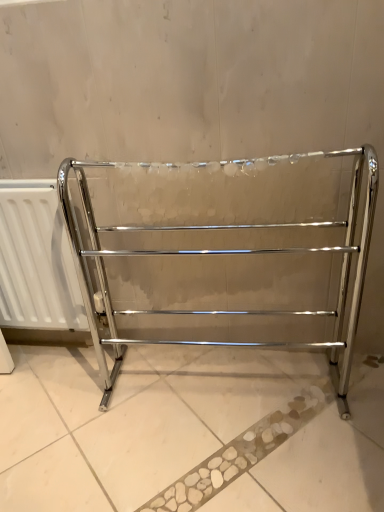
Question: Is white matte radiator at left to the right of polished chrome towel rack at center from the viewer's perspective?

Choices:
 (A) no
 (B) yes

Answer: (A)

Question: From the image's perspective, is white matte radiator at left located above polished chrome towel rack at center?

Choices:
 (A) yes
 (B) no

Answer: (A)

Question: From a real-world perspective, does white matte radiator at left sit lower than polished chrome towel rack at center?

Choices:
 (A) yes
 (B) no

Answer: (A)

Question: From a real-world perspective, is white matte radiator at left positioned over polished chrome towel rack at center based on gravity?

Choices:
 (A) yes
 (B) no

Answer: (B)

Question: From the image's perspective, is white matte radiator at left located beneath polished chrome towel rack at center?

Choices:
 (A) yes
 (B) no

Answer: (B)

Question: Considering the relative sizes of white matte radiator at left and polished chrome towel rack at center in the image provided, is white matte radiator at left shorter than polished chrome towel rack at center?

Choices:
 (A) yes
 (B) no

Answer: (A)

Question: Is polished chrome towel rack at center at the right side of white matte radiator at left?

Choices:
 (A) no
 (B) yes

Answer: (B)

Question: Is polished chrome towel rack at center positioned beyond the bounds of white matte radiator at left?

Choices:
 (A) yes
 (B) no

Answer: (A)

Question: Is polished chrome towel rack at center facing towards white matte radiator at left?

Choices:
 (A) yes
 (B) no

Answer: (B)

Question: Is polished chrome towel rack at center looking in the opposite direction of white matte radiator at left?

Choices:
 (A) no
 (B) yes

Answer: (A)

Question: From the image's perspective, is polished chrome towel rack at center on top of white matte radiator at left?

Choices:
 (A) no
 (B) yes

Answer: (A)

Question: Considering the relative sizes of polished chrome towel rack at center and white matte radiator at left in the image provided, is polished chrome towel rack at center wider than white matte radiator at left?

Choices:
 (A) yes
 (B) no

Answer: (A)

Question: From a real-world perspective, is polished chrome towel rack at center above or below white matte radiator at left?

Choices:
 (A) above
 (B) below

Answer: (A)